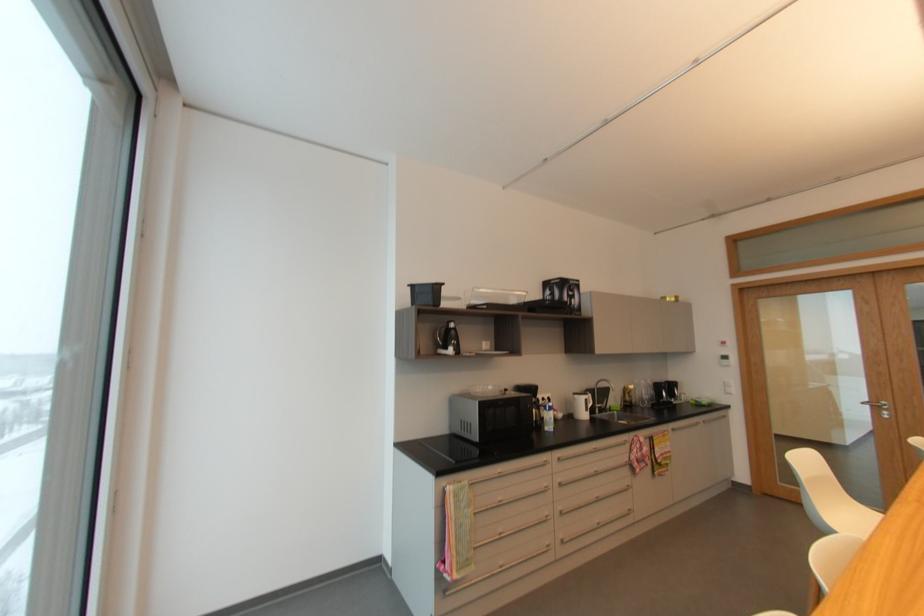
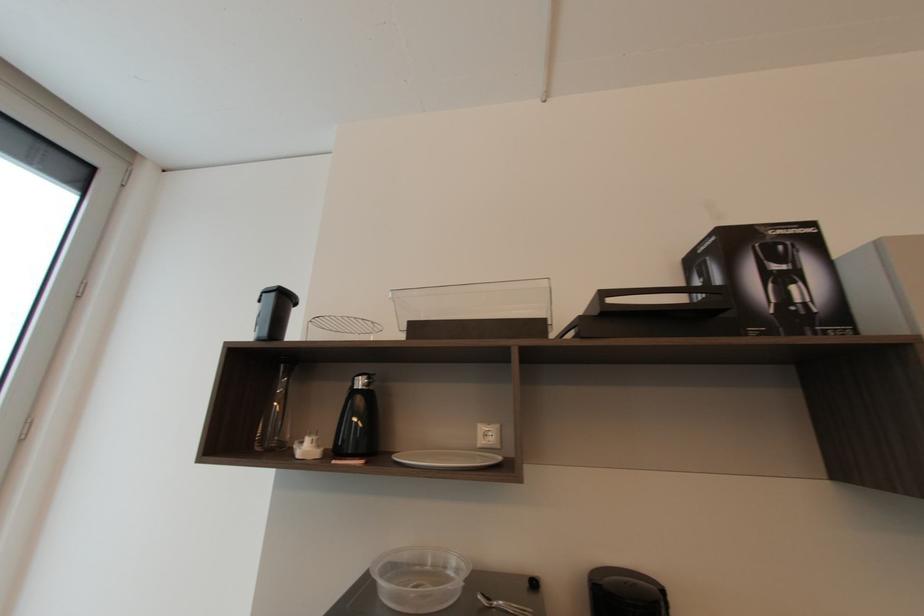
In the second image, find the point that corresponds to [456,323] in the first image.

(362, 384)